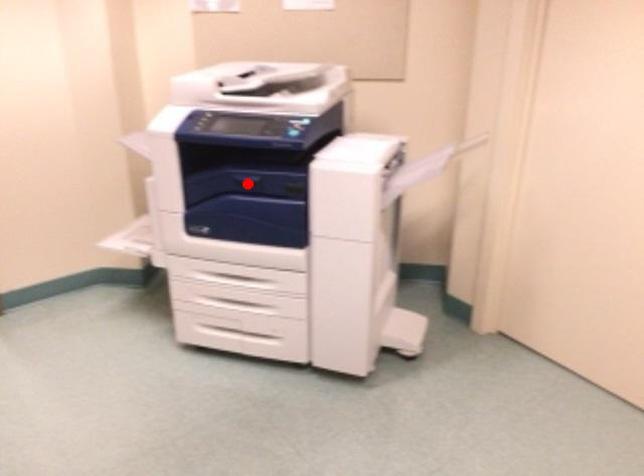
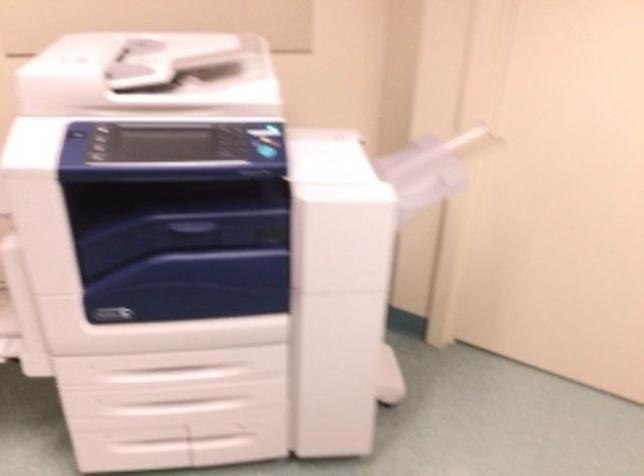
Find the pixel in the second image that matches the highlighted location in the first image.

(196, 231)